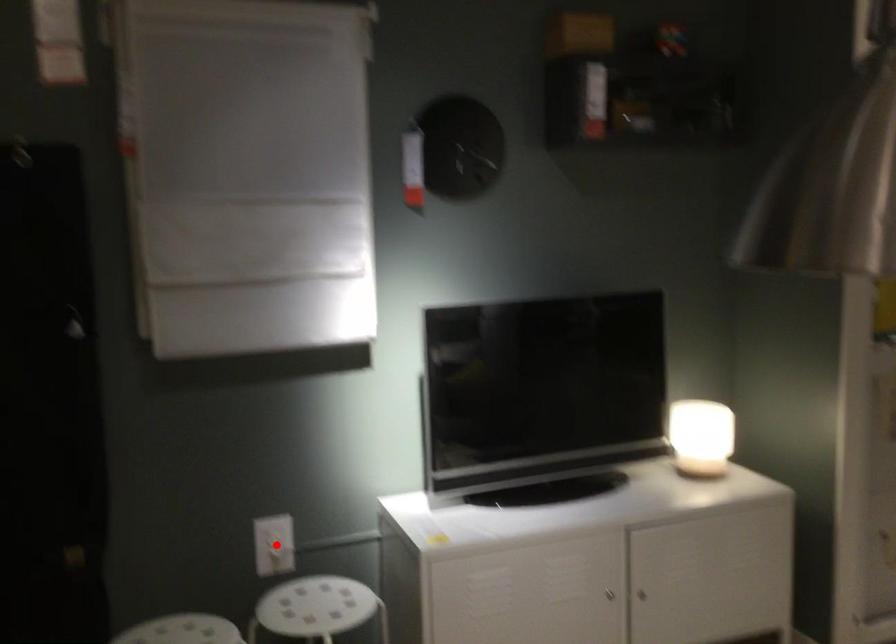
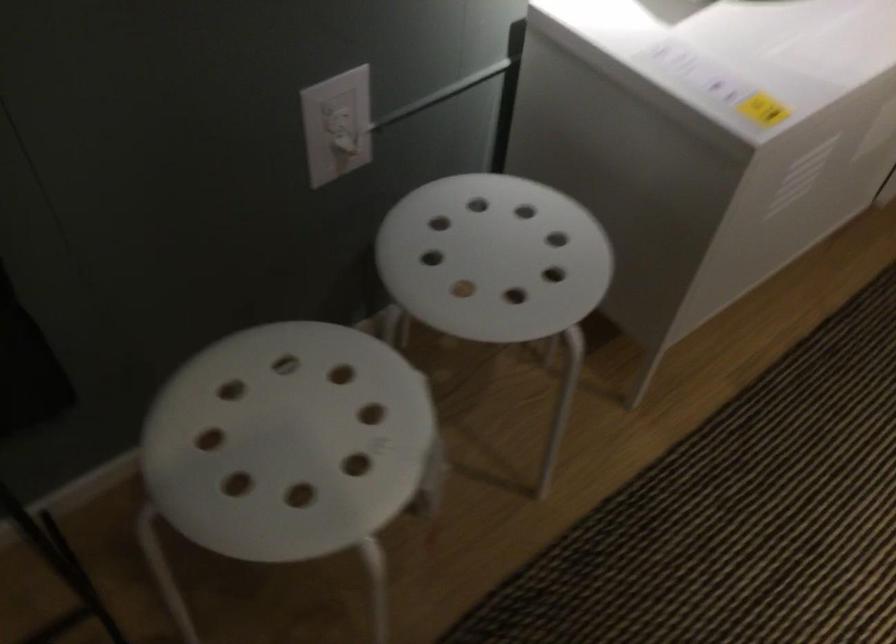
In the second image, find the point that corresponds to the highlighted location in the first image.

(337, 125)